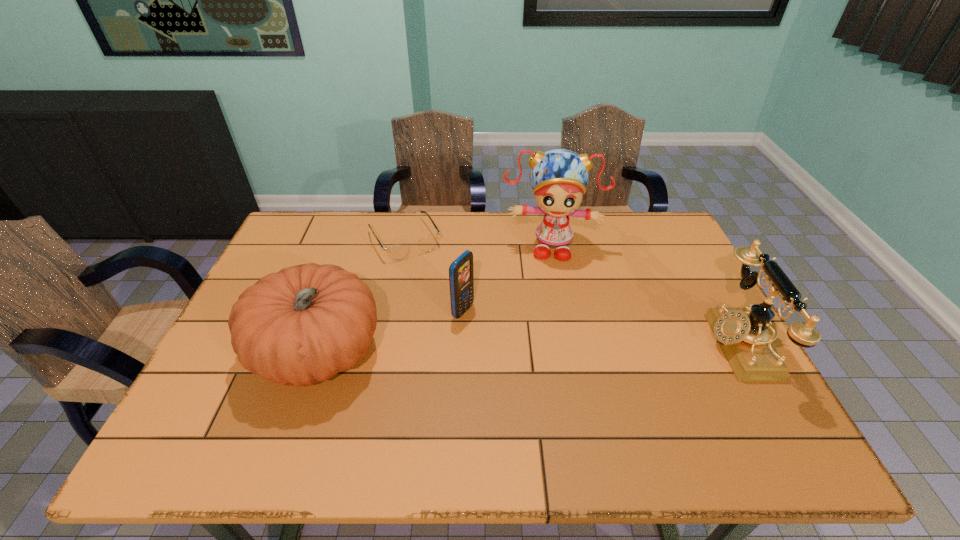
Where is `free space on the desktop that is between the pumpkin and the telephone and is positioned on the screen of the third object from left to right`? The height and width of the screenshot is (540, 960). free space on the desktop that is between the pumpkin and the telephone and is positioned on the screen of the third object from left to right is located at coordinates coord(535,348).

You are a GUI agent. You are given a task and a screenshot of the screen. Output one action in this format:
    pyautogui.click(x=<x>, y=<y>)
    Task: Click on the vacant space on the desktop that is between the pumpkin and the telephone and is positioned on the face of the tallest object
    The width and height of the screenshot is (960, 540).
    Given the screenshot: What is the action you would take?
    pyautogui.click(x=548, y=348)

Find the location of a particular element. The width and height of the screenshot is (960, 540). free space on the desktop that is between the pumpkin and the telephone and is positioned on the front-facing side of the shortest object is located at coordinates (470, 349).